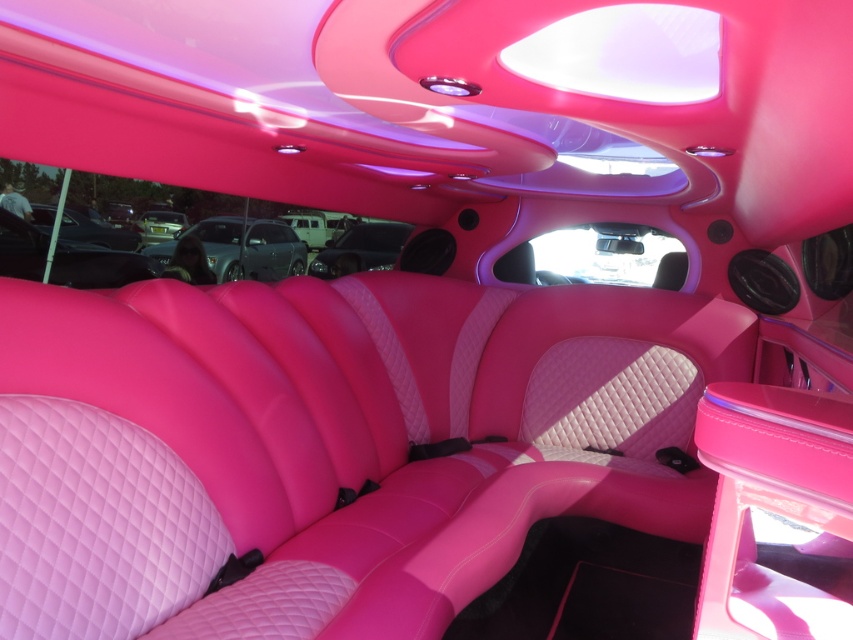
Question: Is matte pink leather car at center positioned in front of glossy metallic car at center?

Choices:
 (A) no
 (B) yes

Answer: (A)

Question: Which object appears farthest from the camera in this image?

Choices:
 (A) glossy metallic car at center
 (B) matte pink leather car at center

Answer: (B)

Question: Does matte pink leather car at center have a greater width compared to glossy metallic car at center?

Choices:
 (A) yes
 (B) no

Answer: (A)

Question: Which object appears closest to the camera in this image?

Choices:
 (A) glossy metallic car at center
 (B) matte pink leather car at center

Answer: (A)

Question: Does matte pink leather car at center appear over glossy metallic car at center?

Choices:
 (A) no
 (B) yes

Answer: (B)

Question: Among these points, which one is nearest to the camera?

Choices:
 (A) (393, 262)
 (B) (254, 218)

Answer: (A)